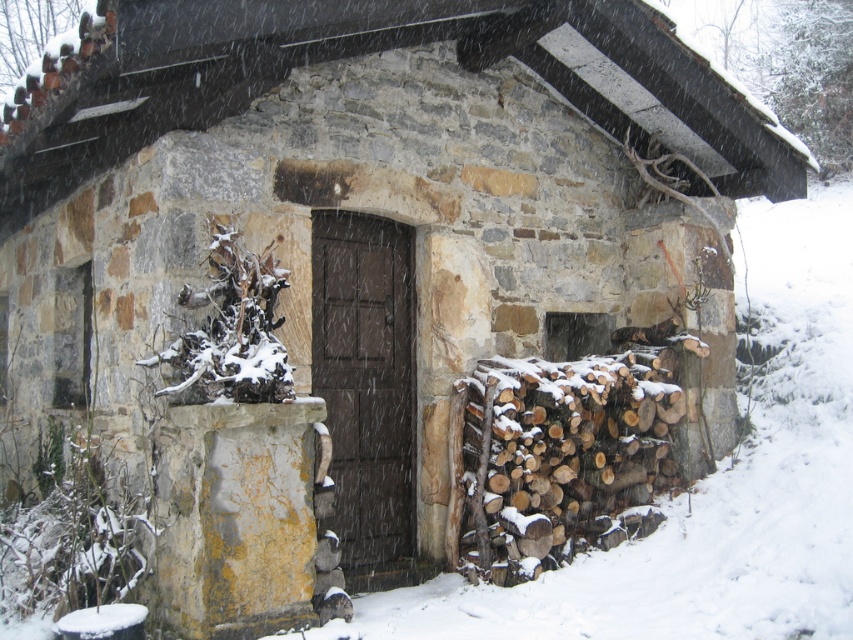
Question: From the image, what is the correct spatial relationship of snow-covered woodpile at lower right in relation to dark wood door at center?

Choices:
 (A) below
 (B) above

Answer: (A)

Question: Is snow-covered woodpile at lower right thinner than dark wood door at center?

Choices:
 (A) yes
 (B) no

Answer: (B)

Question: Which point is closer to the camera?

Choices:
 (A) dark wood door at center
 (B) snow-covered woodpile at lower right

Answer: (A)

Question: Among these points, which one is farthest from the camera?

Choices:
 (A) (502, 529)
 (B) (323, 385)

Answer: (B)

Question: Is snow-covered woodpile at lower right closer to camera compared to dark wood door at center?

Choices:
 (A) no
 (B) yes

Answer: (A)